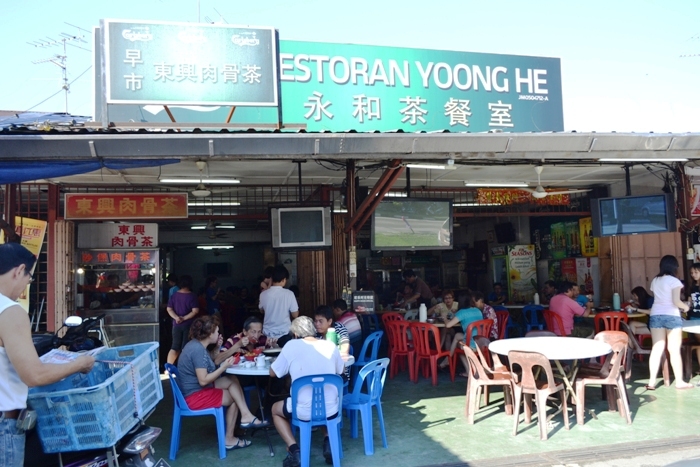
Locate an element on the screen. Image resolution: width=700 pixels, height=467 pixels. beige chairs is located at coordinates (483, 381), (497, 367), (532, 380), (580, 380), (622, 340).